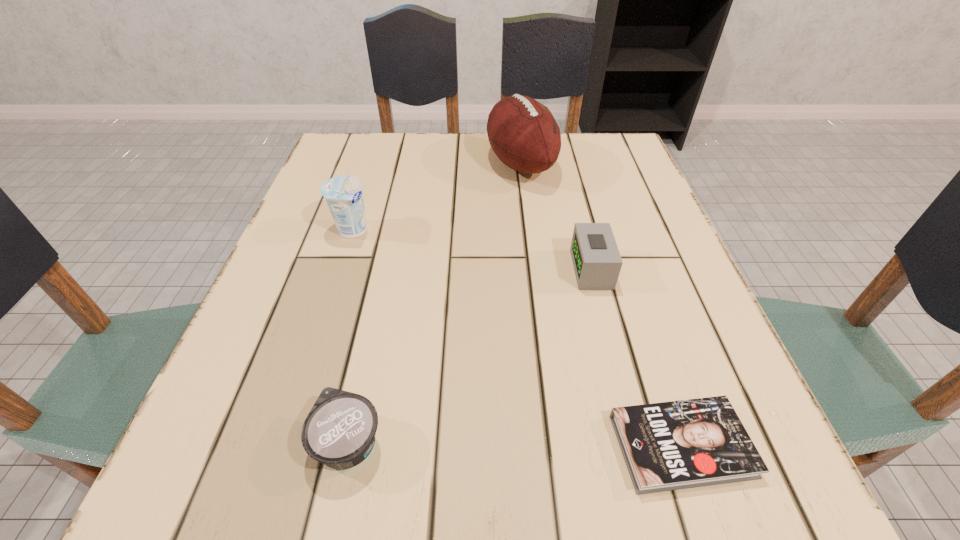
The height and width of the screenshot is (540, 960). Find the location of `book that is at the right edge`. book that is at the right edge is located at coordinates (674, 445).

At what (x,y) coordinates should I click in order to perform the action: click on object that is at the near left corner. Please return your answer as a coordinate pair (x, y). The image size is (960, 540). Looking at the image, I should click on (340, 430).

Locate an element on the screen. The width and height of the screenshot is (960, 540). object located at the near right corner is located at coordinates (674, 445).

Where is `free region at the far edge`? The width and height of the screenshot is (960, 540). free region at the far edge is located at coordinates (474, 178).

In order to click on vacant area at the near edge in this screenshot , I will do `click(347, 522)`.

Locate an element on the screen. This screenshot has height=540, width=960. vacant space at the left edge is located at coordinates (264, 305).

Image resolution: width=960 pixels, height=540 pixels. What are the coordinates of `blank space at the right edge` in the screenshot? It's located at (651, 205).

At what (x,y) coordinates should I click in order to perform the action: click on vacant region at the far left corner of the desktop. Please return your answer as a coordinate pair (x, y). Looking at the image, I should click on (319, 181).

This screenshot has width=960, height=540. In order to click on vacant space in between the shortest object and the fourth nearest object in this screenshot , I will do `click(517, 338)`.

Locate an element on the screen. This screenshot has height=540, width=960. free spot between the fourth shortest object and the book is located at coordinates (517, 338).